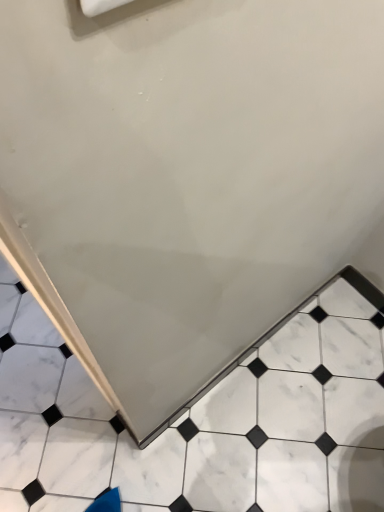
Find the location of a particular element. matte glass shower door at center is located at coordinates (201, 421).

Measure the distance between matte glass shower door at center and camera.

matte glass shower door at center is 1.15 meters away from camera.

The width and height of the screenshot is (384, 512). What do you see at coordinates (201, 421) in the screenshot?
I see `matte glass shower door at center` at bounding box center [201, 421].

Where is `matte glass shower door at center`? This screenshot has width=384, height=512. matte glass shower door at center is located at coordinates (201, 421).